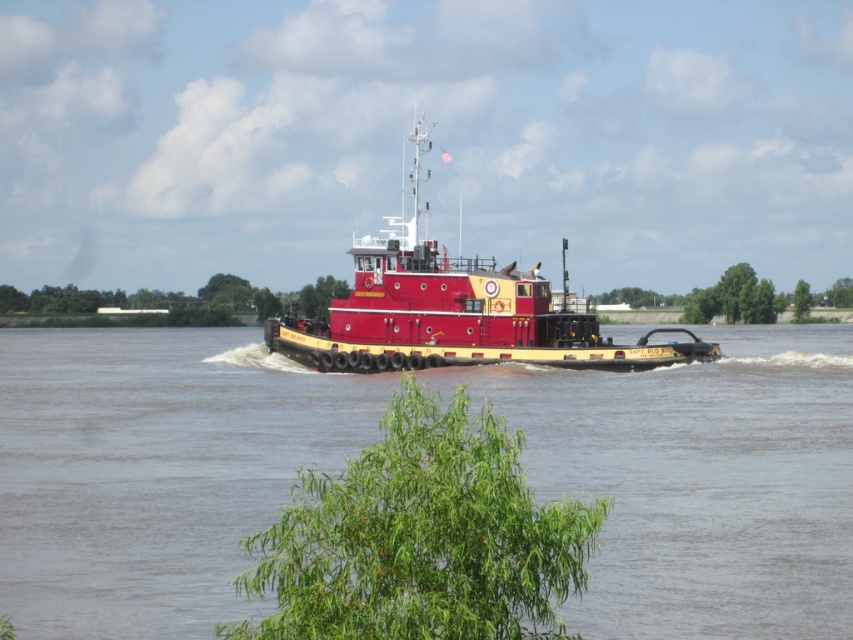
Which of these two, green leafy tree at lower center or shiny red tugboat at center, stands shorter?

green leafy tree at lower center

You are a GUI agent. You are given a task and a screenshot of the screen. Output one action in this format:
    pyautogui.click(x=<x>, y=<y>)
    Task: Click on the green leafy tree at lower center
    The width and height of the screenshot is (853, 640).
    Given the screenshot: What is the action you would take?
    (421, 538)

The height and width of the screenshot is (640, 853). Identify the location of green leafy tree at lower center. (421, 538).

Between point (621, 577) and point (793, 296), which one is positioned behind?

Point (793, 296)

Does point (662, 472) come behind point (793, 308)?

No, (662, 472) is in front of (793, 308).

Identify the location of brown matte river at center. The image size is (853, 640). (154, 470).

The image size is (853, 640). What do you see at coordinates (421, 538) in the screenshot?
I see `green leafy tree at lower center` at bounding box center [421, 538].

Can you confirm if green leafy tree at lower center is positioned to the left of green leafy tree at center?

Correct, you'll find green leafy tree at lower center to the left of green leafy tree at center.

Where is `green leafy tree at lower center`? The image size is (853, 640). green leafy tree at lower center is located at coordinates (421, 538).